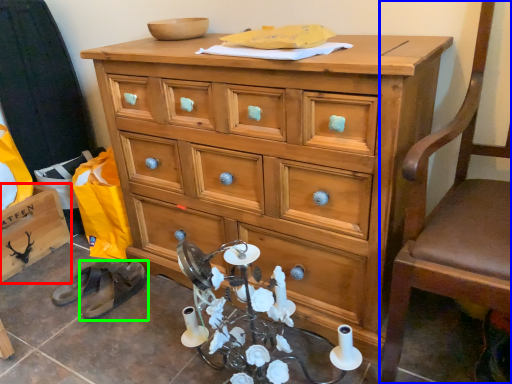
Question: Based on their relative distances, which object is nearer to cabinetry (highlighted by a red box)? Choose from swivel chair (highlighted by a blue box) and footwear (highlighted by a green box).

Choices:
 (A) swivel chair
 (B) footwear

Answer: (B)